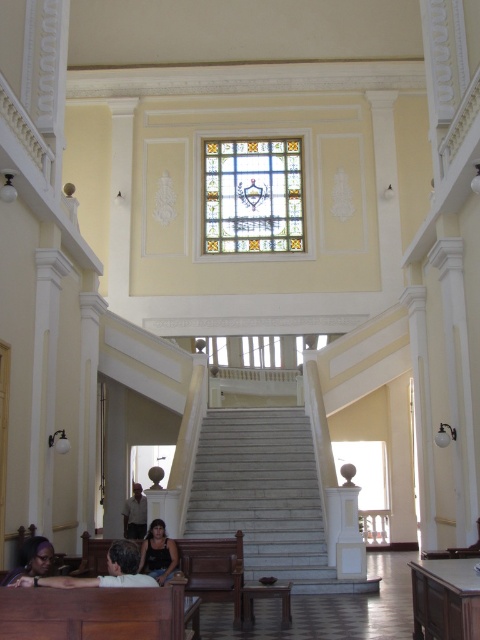
You are a visitor entering the building and see the white marble stairs at center and the light brown leather jacket at lower center. Which object is bigger in size?

The white marble stairs at center has a larger size compared to the light brown leather jacket at lower center, so the white marble stairs at center is bigger.

You are an architect visiting this building and need to install a new light fixture. The stained glass at center and the wooden polished bench at lower left are in your way. Which object is taller and would require adjusting the fixture height?

The stained glass at center is much taller than the wooden polished bench at lower left, so you would need to adjust the fixture height to accommodate its height.